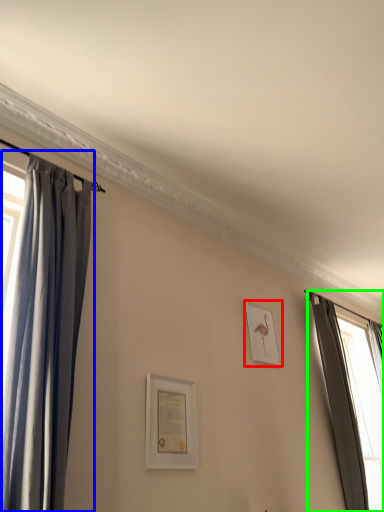
Question: Which object is the farthest from picture frame (highlighted by a red box)? Choose among these: curtain (highlighted by a blue box) or curtain (highlighted by a green box).

Choices:
 (A) curtain
 (B) curtain

Answer: (B)